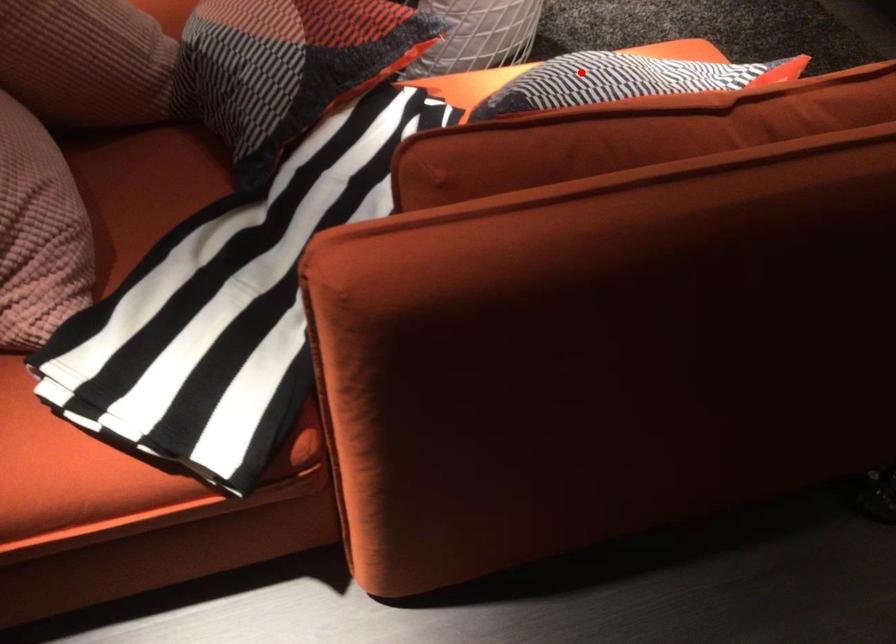
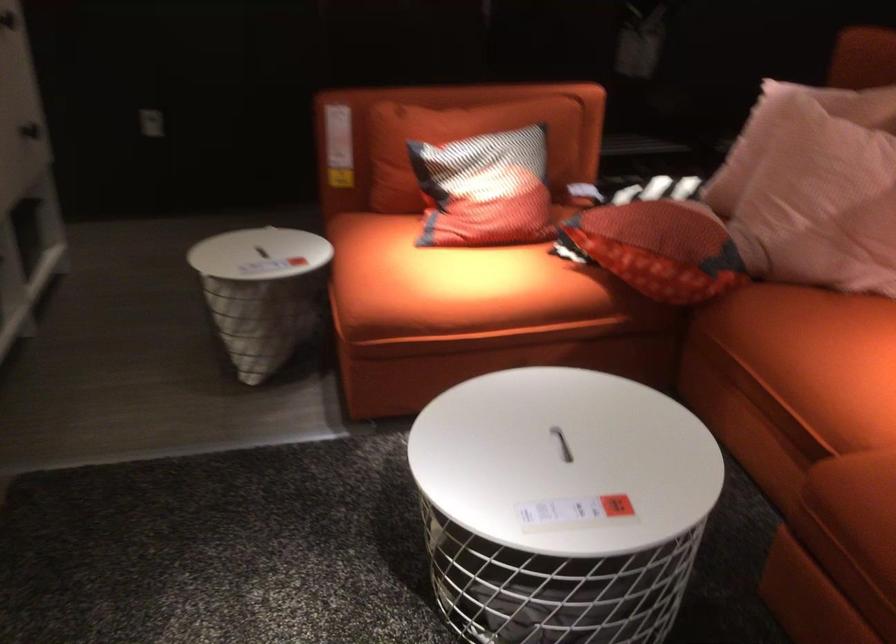
Locate, in the second image, the point that corresponds to the highlighted location in the first image.

(485, 190)